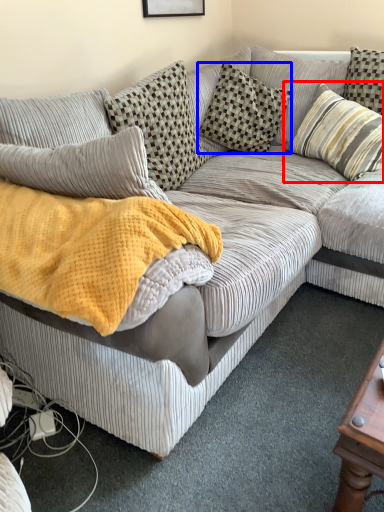
Question: Which object appears closest to the camera in this image, pillow (highlighted by a red box) or pillow (highlighted by a blue box)?

Choices:
 (A) pillow
 (B) pillow

Answer: (A)